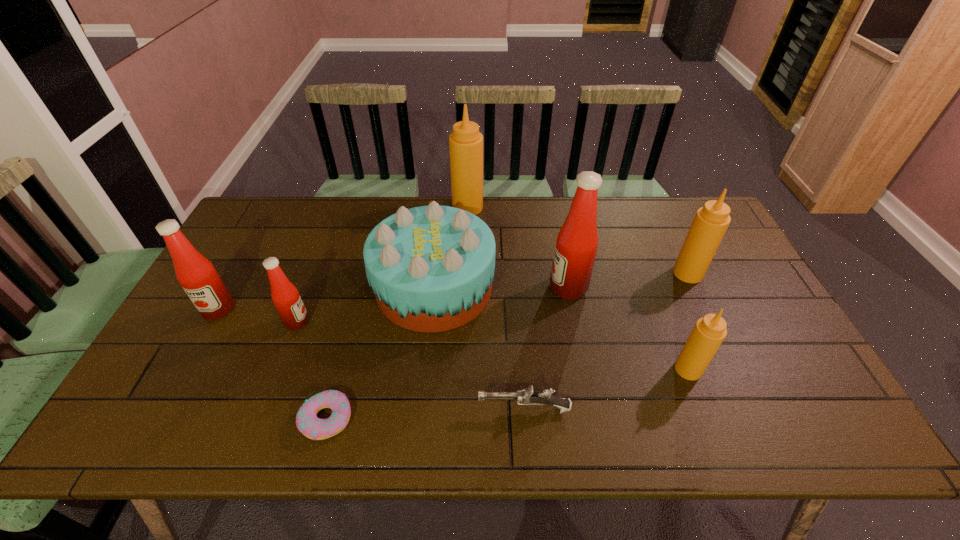
Locate an element on the screen. This screenshot has width=960, height=540. doughnut situated at the near edge is located at coordinates (307, 422).

Locate an element on the screen. The height and width of the screenshot is (540, 960). object that is at the left edge is located at coordinates (196, 274).

Identify the location of object present at the right edge. Image resolution: width=960 pixels, height=540 pixels. (711, 221).

This screenshot has height=540, width=960. What are the coordinates of `free location at the far edge of the desktop` in the screenshot? It's located at (528, 225).

Identify the location of vacant space at the near edge of the desktop. (204, 418).

Identify the location of vacant space at the left edge of the desktop. (230, 347).

You are a GUI agent. You are given a task and a screenshot of the screen. Output one action in this format:
    pyautogui.click(x=<x>, y=<y>)
    Task: Click on the vacant space at the right edge
    
    Given the screenshot: What is the action you would take?
    pyautogui.click(x=727, y=274)

Find the location of a particular element. The height and width of the screenshot is (540, 960). free point at the far left corner is located at coordinates (260, 232).

What are the coordinates of `free space at the far right corner of the desktop` in the screenshot? It's located at (695, 212).

Find the location of a particular element. free space at the near right corner of the desktop is located at coordinates (824, 423).